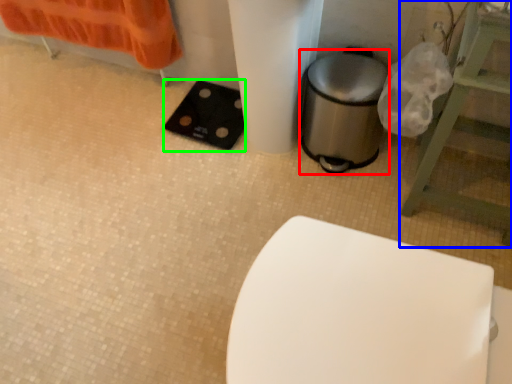
Question: Based on their relative distances, which object is nearer to appliance (highlighted by a red box)? Choose from furniture (highlighted by a blue box) and pad (highlighted by a green box).

Choices:
 (A) furniture
 (B) pad

Answer: (A)